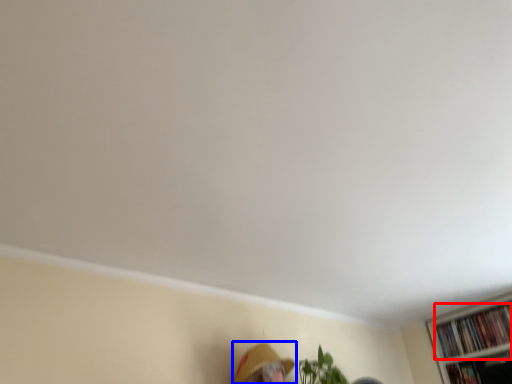
Question: Among these objects, which one is farthest to the camera, book (highlighted by a red box) or person (highlighted by a blue box)?

Choices:
 (A) book
 (B) person

Answer: (A)